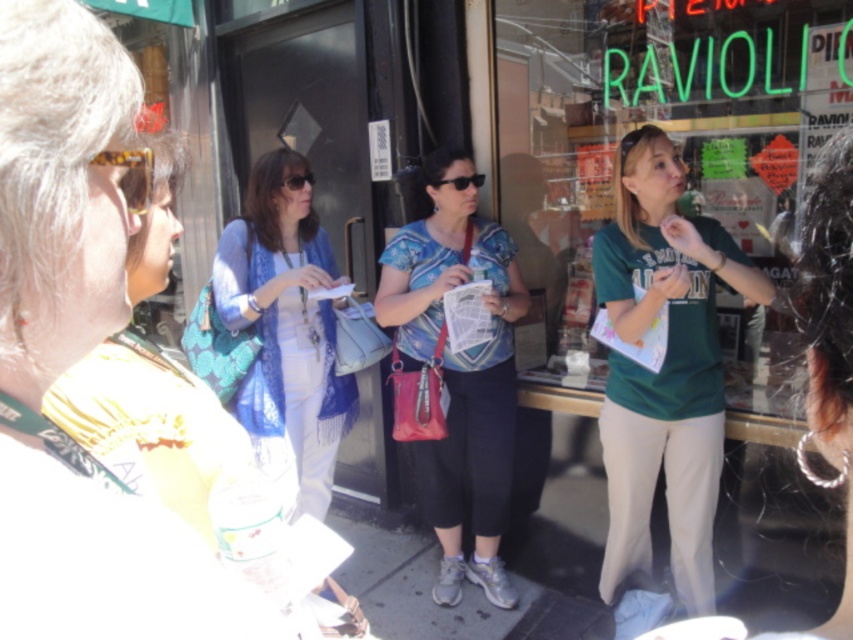
Between point (335, 448) and point (454, 179), which one is positioned behind?

The point (335, 448) is behind.

Does point (219, 236) come closer to viewer compared to point (468, 176)?

No, it is not.

This screenshot has width=853, height=640. In order to click on light blue lace cardigan at center in this screenshot , I will do `click(285, 332)`.

Which of these two, black plastic sunglasses at center or matte black sunglasses at center, stands shorter?

Standing shorter between the two is black plastic sunglasses at center.

Is black plastic sunglasses at center shorter than matte black sunglasses at center?

Indeed, black plastic sunglasses at center has a lesser height compared to matte black sunglasses at center.

The height and width of the screenshot is (640, 853). I want to click on black plastic sunglasses at center, so click(x=461, y=180).

Looking at this image, between matte blue blouse at center and matte black sunglasses at center, which one has less height?

Standing shorter between the two is matte black sunglasses at center.

This screenshot has width=853, height=640. Identify the location of matte blue blouse at center. (457, 372).

The height and width of the screenshot is (640, 853). Identify the location of matte blue blouse at center. (457, 372).